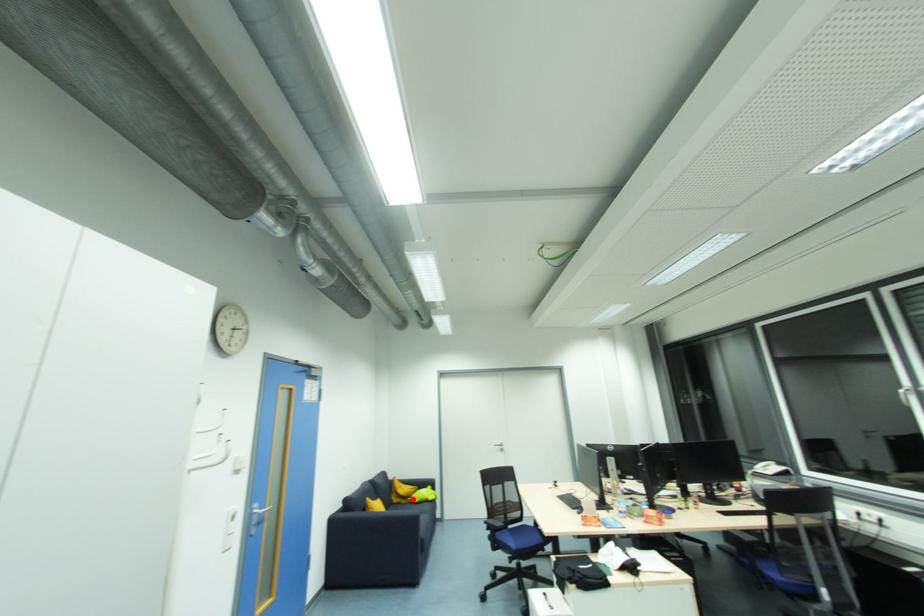
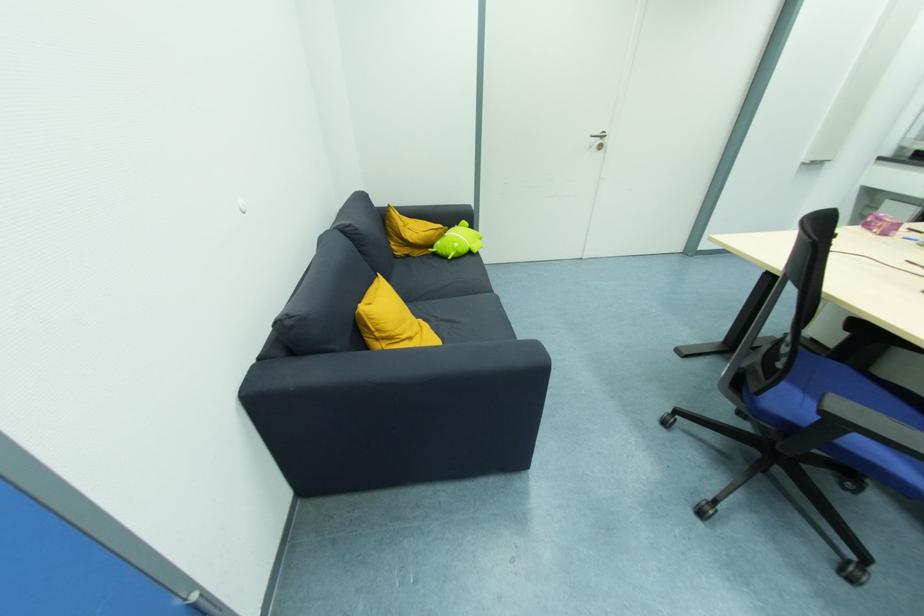
The point at the highlighted location is marked in the first image. Where is the corresponding point in the second image?

(435, 248)